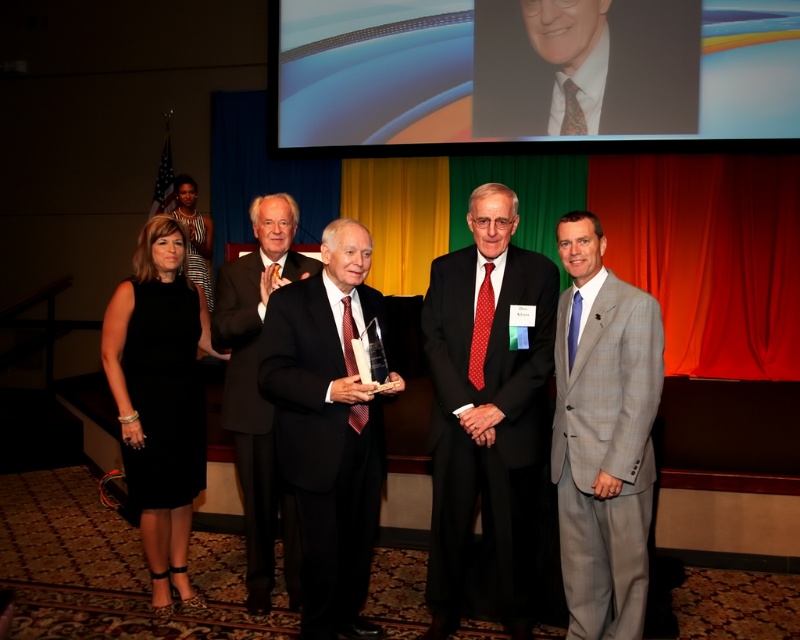
Question: Does black silk suit at center have a lesser width compared to gray checkered suit at right?

Choices:
 (A) yes
 (B) no

Answer: (B)

Question: Which of the following is the closest to the observer?

Choices:
 (A) (x=270, y=556)
 (B) (x=336, y=611)

Answer: (B)

Question: Which point is closer to the camera?

Choices:
 (A) black dress at lower left
 (B) black satin suit at center
 (C) gray checkered suit at right

Answer: (C)

Question: Does black silk suit at center have a larger size compared to gray checkered suit at right?

Choices:
 (A) no
 (B) yes

Answer: (B)

Question: Which point appears closest to the camera in this image?

Choices:
 (A) (470, 358)
 (B) (560, 484)
 (C) (316, 413)

Answer: (C)

Question: Does black dress at lower left come in front of black suit at center?

Choices:
 (A) yes
 (B) no

Answer: (B)